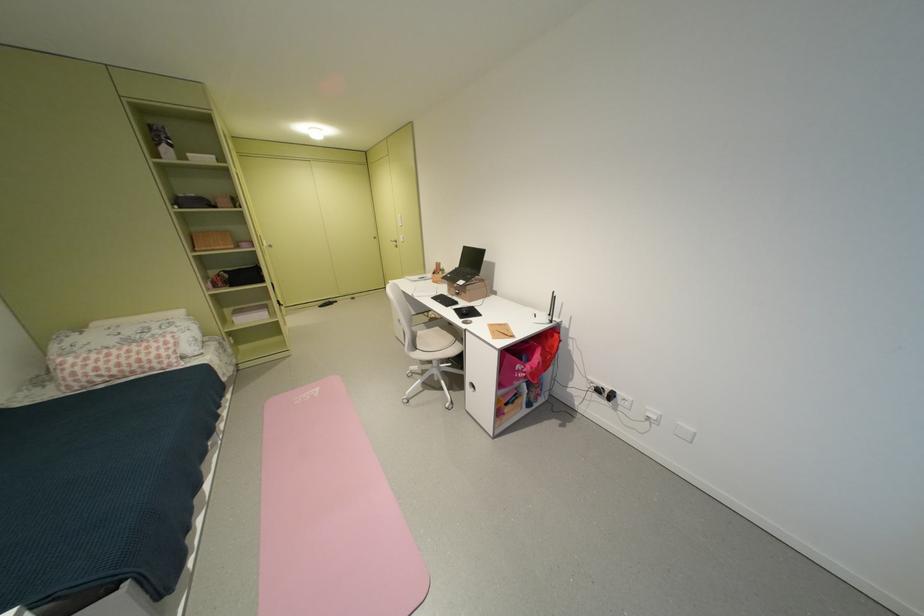
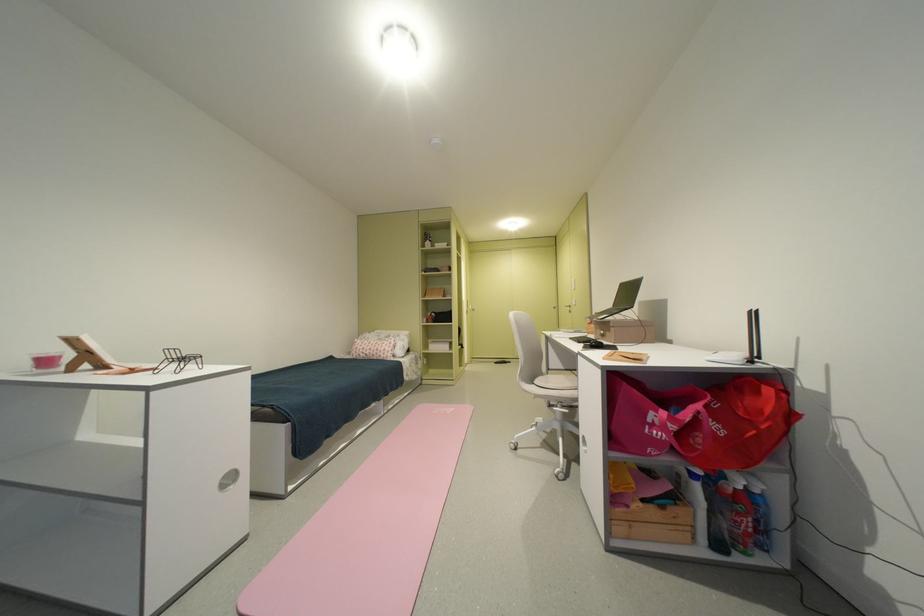
In the second image, find the point that corresponds to the point at 159,362 in the first image.

(390, 352)